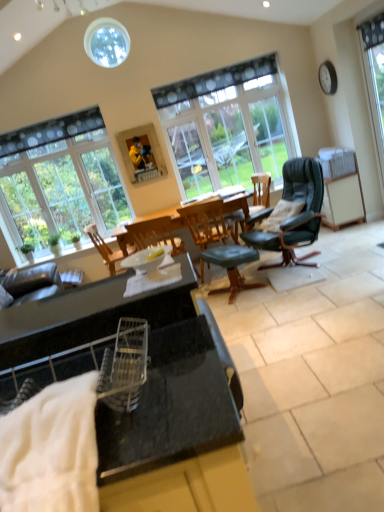
Question: Is black granite cabinet at center not close to green leather chair at center, the 2th chair from the right?

Choices:
 (A) yes
 (B) no

Answer: (A)

Question: Can you confirm if black granite cabinet at center is thinner than green leather chair at center, the 2th chair from the right?

Choices:
 (A) no
 (B) yes

Answer: (A)

Question: From the image's perspective, is black granite cabinet at center located above green leather chair at center, the second chair when ordered from left to right?

Choices:
 (A) yes
 (B) no

Answer: (B)

Question: Is black granite cabinet at center positioned before green leather chair at center, the 2th chair from the right?

Choices:
 (A) no
 (B) yes

Answer: (B)

Question: Is black granite cabinet at center completely or partially outside of green leather chair at center, the 2th chair from the right?

Choices:
 (A) yes
 (B) no

Answer: (A)

Question: Considering the relative positions of wooden picture frame at upper center and white textured blanket at lower left in the image provided, is wooden picture frame at upper center to the left or to the right of white textured blanket at lower left?

Choices:
 (A) right
 (B) left

Answer: (B)

Question: From a real-world perspective, is wooden picture frame at upper center physically located above or below white textured blanket at lower left?

Choices:
 (A) above
 (B) below

Answer: (A)

Question: From the image's perspective, is wooden picture frame at upper center above or below white textured blanket at lower left?

Choices:
 (A) below
 (B) above

Answer: (B)

Question: Is wooden picture frame at upper center situated inside white textured blanket at lower left or outside?

Choices:
 (A) outside
 (B) inside

Answer: (A)

Question: From the image's perspective, relative to clear glass window at upper left, the third window in the front-to-back sequence, is wooden chair at center, the 3th chair viewed from the right, above or below?

Choices:
 (A) above
 (B) below

Answer: (B)

Question: Is wooden chair at center, the 3th chair viewed from the right, to the left or to the right of clear glass window at upper left, marked as the first window in a left-to-right arrangement, in the image?

Choices:
 (A) right
 (B) left

Answer: (A)

Question: Does point (94, 243) appear closer or farther from the camera than point (43, 180)?

Choices:
 (A) farther
 (B) closer

Answer: (B)

Question: Considering their positions, is wooden chair at center, the first chair when ordered from left to right, located in front of or behind clear glass window at upper left, the third window in the front-to-back sequence?

Choices:
 (A) front
 (B) behind

Answer: (A)

Question: Looking at the image, does clear glass window at upper left, marked as the first window in a left-to-right arrangement, seem bigger or smaller compared to green leather stool at center?

Choices:
 (A) small
 (B) big

Answer: (B)

Question: In terms of width, does clear glass window at upper left, the third window in the front-to-back sequence, look wider or thinner when compared to green leather stool at center?

Choices:
 (A) thin
 (B) wide

Answer: (A)